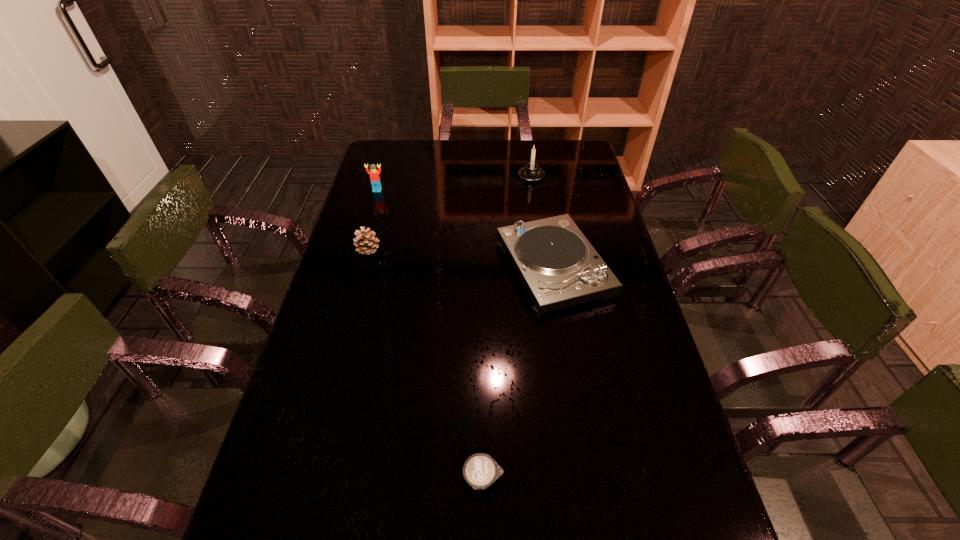
Where is `free location located 0.240m on the back of the pinecone`? free location located 0.240m on the back of the pinecone is located at coordinates (381, 200).

At what (x,y) coordinates should I click in order to perform the action: click on vacant space located 0.290m on the back of the record player. Please return your answer as a coordinate pair (x, y). Looking at the image, I should click on pos(539,181).

The image size is (960, 540). I want to click on vacant area located 0.260m on the left of the yogurt, so click(x=341, y=478).

Find the location of a particular element. The width and height of the screenshot is (960, 540). object present at the far edge is located at coordinates (531, 172).

Locate an element on the screen. Lego present at the left edge is located at coordinates (374, 174).

Locate an element on the screen. pinecone positioned at the left edge is located at coordinates 365,241.

This screenshot has width=960, height=540. Identify the location of object at the right edge. (557, 265).

At what (x,y) coordinates should I click in order to perform the action: click on free space at the far edge of the desktop. Please return your answer as a coordinate pair (x, y). Looking at the image, I should click on (530, 144).

In the image, there is a desktop. Where is `vacant space at the left edge`? vacant space at the left edge is located at coordinates click(316, 394).

In the image, there is a desktop. At what (x,y) coordinates should I click in order to perform the action: click on vacant space at the right edge. Please return your answer as a coordinate pair (x, y). The image size is (960, 540). Looking at the image, I should click on (604, 309).